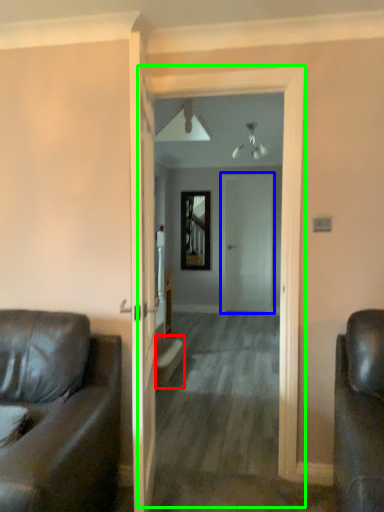
Question: Considering the real-world distances, which object is closest to stairwell (highlighted by a red box)? door (highlighted by a blue box) or corridor (highlighted by a green box).

Choices:
 (A) door
 (B) corridor

Answer: (B)